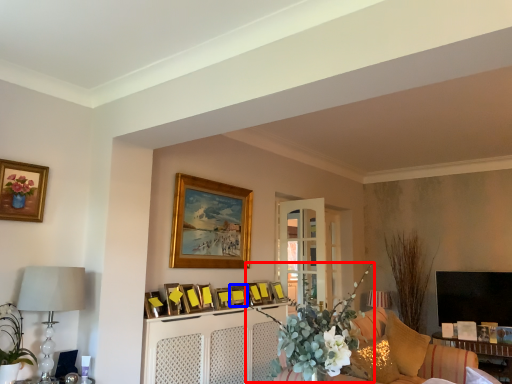
Question: Which point is further to the camera, floral arrangement (highlighted by a red box) or picture frame (highlighted by a blue box)?

Choices:
 (A) floral arrangement
 (B) picture frame

Answer: (B)